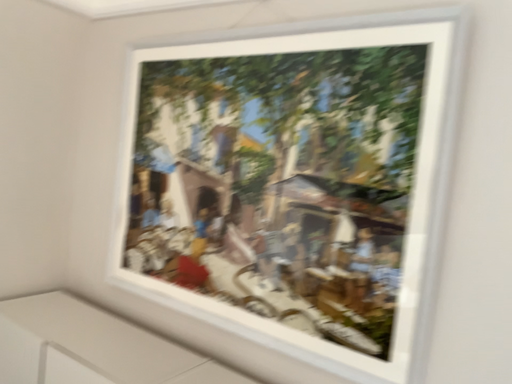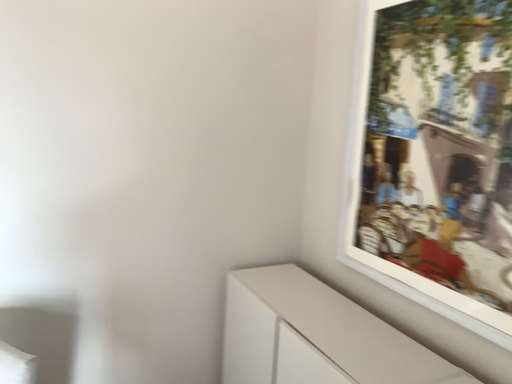
Question: Which way did the camera rotate in the video?

Choices:
 (A) rotated right
 (B) rotated left

Answer: (B)